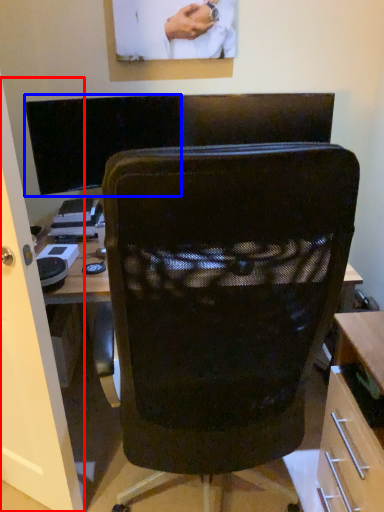
Question: Which object appears farthest to the camera in this image, glass door (highlighted by a red box) or computer monitor (highlighted by a blue box)?

Choices:
 (A) glass door
 (B) computer monitor

Answer: (B)